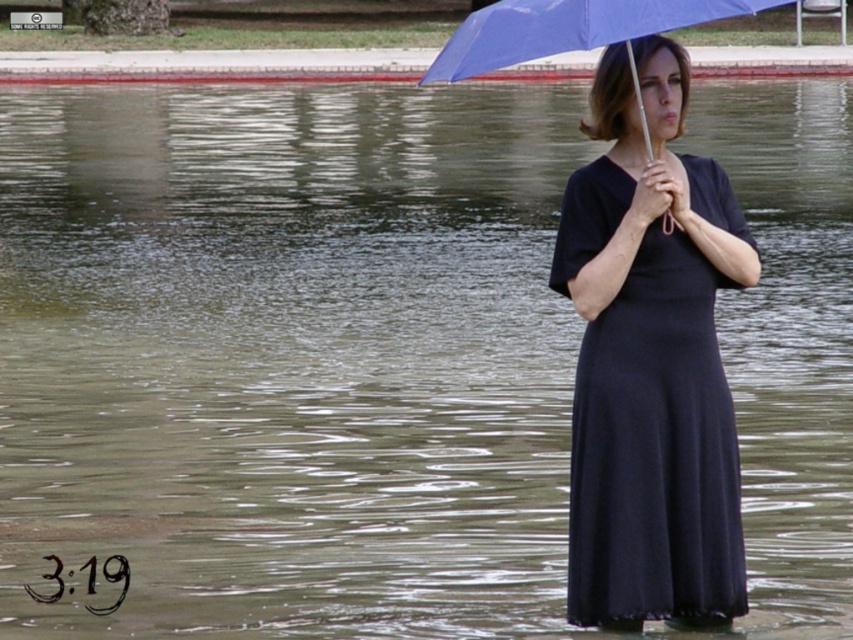
You are a photographer planning to take a portrait of the person in the scene. Since you want to focus on the person, you need to decide whether to adjust the camera to blur the background or not. Based on the position of the blue matte umbrella at upper center and the black matte dress at center, should you blur the background to ensure the person is the main focus?

The blue matte umbrella at upper center is behind the black matte dress at center, so blurring the background would help the person in the black matte dress at center stand out more as the main focus.

You are a photographer planning to take a portrait of the person in the image. The black matte dress at center and the blue matte umbrella at upper center are both in the frame. Considering their sizes in the image, which object should you focus on to ensure the subject is prominent?

The blue matte umbrella at upper center occupies more space in the image than the black matte dress at center, so focusing on it would make the subject more prominent.